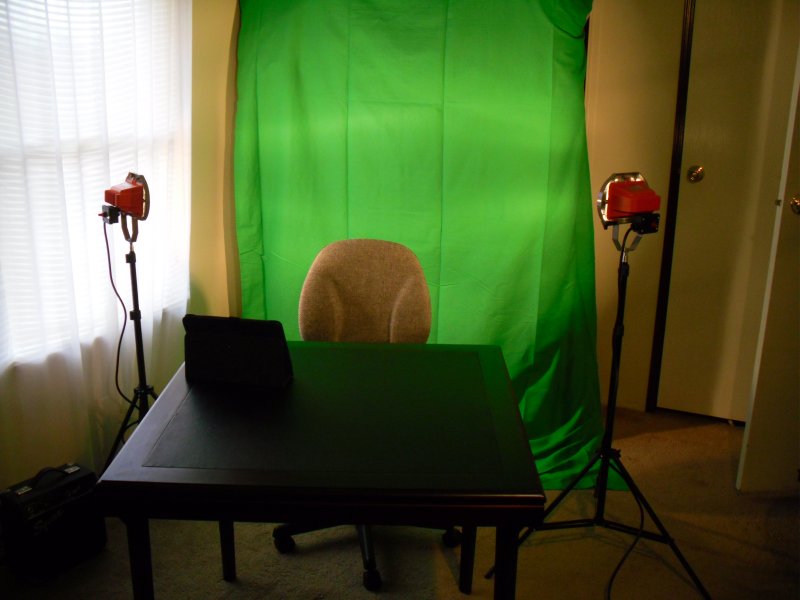
Where is `drywall`? drywall is located at coordinates (621, 115).